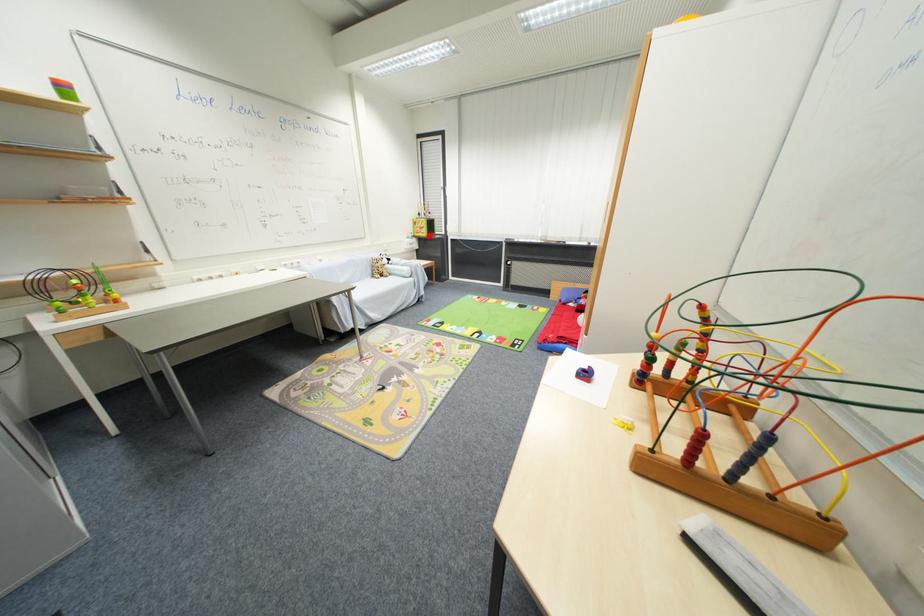
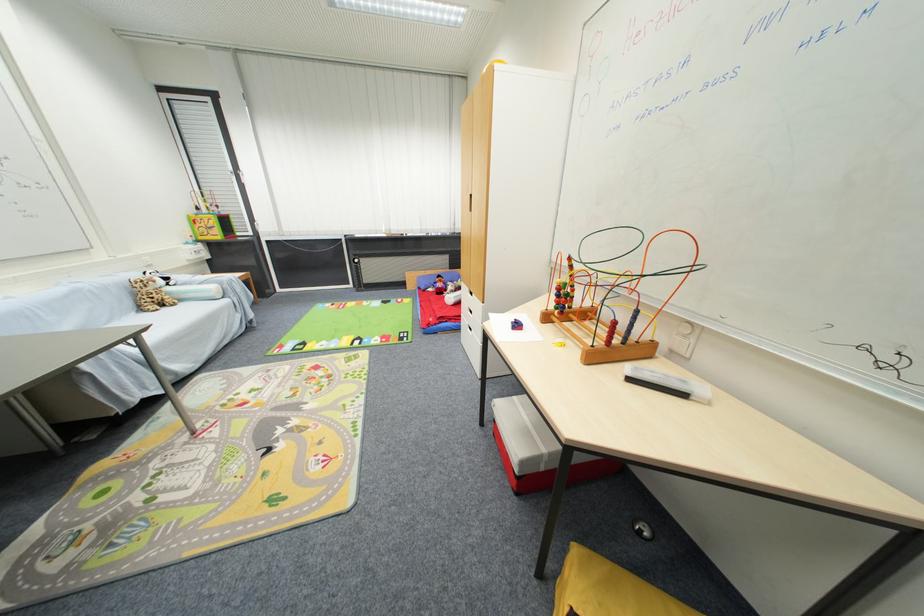
Question: I am providing you with two images of the same scene from different viewpoints. Given a red point in image1, look at the same physical point in image2. Is it:

Choices:
 (A) Closer to the viewpoint
 (B) Farther from the viewpoint

Answer: (B)